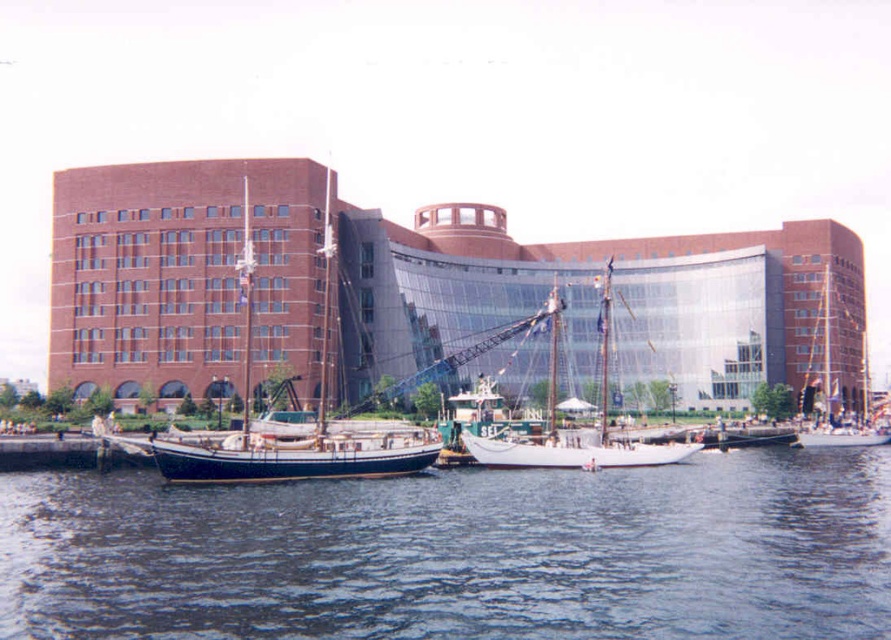
Which is above, blue water at center or dark blue polished wood sailboat at left?

dark blue polished wood sailboat at left is higher up.

Which is behind, point (434, 616) or point (233, 452)?

The point (233, 452) is behind.

The width and height of the screenshot is (891, 640). Find the location of `blue water at center`. blue water at center is located at coordinates (458, 552).

Who is lower down, dark blue polished wood sailboat at left or white wooden sailboat at center?

dark blue polished wood sailboat at left is below.

In the scene shown: Who is taller, dark blue polished wood sailboat at left or white wooden sailboat at center?

Standing taller between the two is dark blue polished wood sailboat at left.

Who is more distant from viewer, [292,442] or [634,464]?

The point [634,464] is behind.

What are the coordinates of `dark blue polished wood sailboat at left` in the screenshot? It's located at (316, 412).

Who is positioned more to the left, blue water at center or white wooden sailboat at center?

blue water at center

Measure the distance between blue water at center and camera.

blue water at center and camera are 33.44 meters apart.

Does point (169, 577) come closer to viewer compared to point (598, 424)?

Yes, point (169, 577) is in front of point (598, 424).

Identify the location of blue water at center. This screenshot has width=891, height=640. (458, 552).